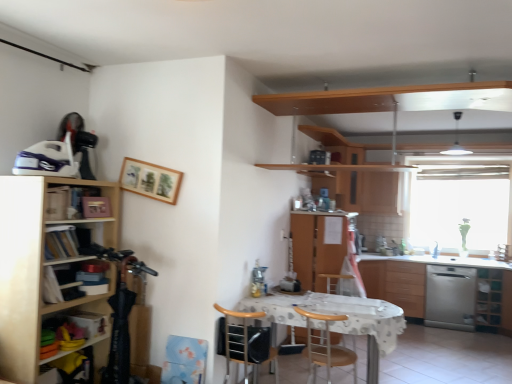
Question: Choose the correct answer: Is wooden chair at center, positioned as the 2th chair in right-to-left order, inside light wood cabinet at left, which is counted as the first cabinetry, starting from the left, or outside it?

Choices:
 (A) outside
 (B) inside

Answer: (A)

Question: From the image's perspective, is wooden chair at center, positioned as the 2th chair in right-to-left order, located above or below light wood cabinet at left, positioned as the third cabinetry in right-to-left order?

Choices:
 (A) below
 (B) above

Answer: (A)

Question: Estimate the real-world distances between objects in this image. Which object is closer to the green glass cabinet at lower right, the 2th cabinet when ordered from top to bottom?

Choices:
 (A) transparent glass window at right
 (B) wooden cabinet at center, which is the second cabinetry in back-to-front order
 (C) stainless steel dishwasher at right
 (D) light wood cabinet at left, marked as the first cabinetry in a front-to-back arrangement
 (E) brown wood cabinet at right, arranged as the third cabinetry when viewed from the left

Answer: (C)

Question: Estimate the real-world distances between objects in this image. Which object is farther from the transparent glass window at right?

Choices:
 (A) wooden picture frame at upper center
 (B) brown wood chair at center, the 2th chair from the left
 (C) brown wood cabinet at right, arranged as the third cabinetry when viewed from the left
 (D) stainless steel dishwasher at right
 (E) green glass cabinet at lower right, the second cabinet from the left

Answer: (A)